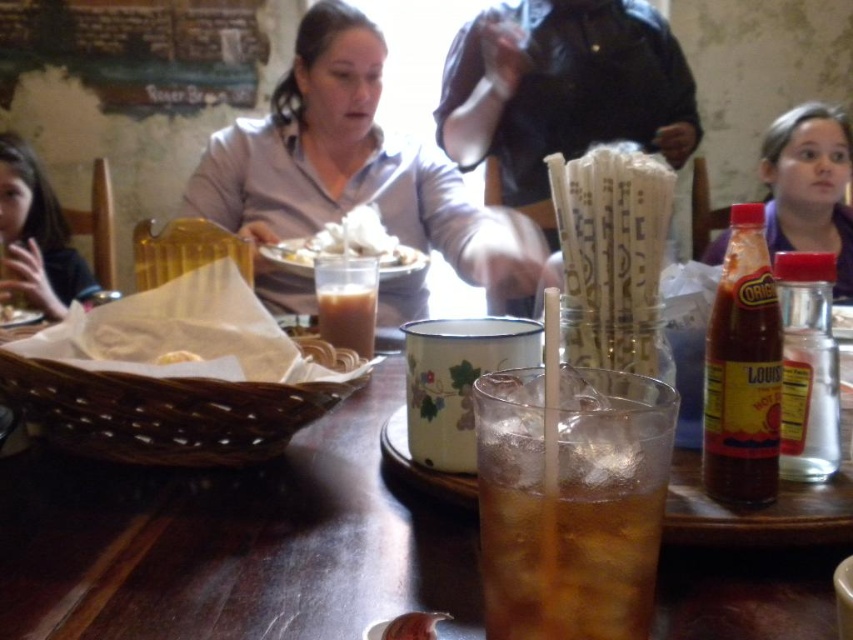
Question: Which object appears farthest from the camera in this image?

Choices:
 (A) brown matte bread at center
 (B) brown translucent glass at center
 (C) white crumbly bread at center

Answer: (C)

Question: Observing the image, what is the correct spatial positioning of white fluffy bread at center in reference to brown matte bread at center?

Choices:
 (A) right
 (B) left

Answer: (B)

Question: Is matte purple shirt at upper right thinner than white crumbly bread at center?

Choices:
 (A) yes
 (B) no

Answer: (B)

Question: Which of the following is the closest to the observer?

Choices:
 (A) translucent glass at center
 (B) brown matte bread at center
 (C) dark brown hair at left

Answer: (B)

Question: Does dark brown hair at left have a lesser width compared to white fluffy bread at center?

Choices:
 (A) yes
 (B) no

Answer: (B)

Question: Estimate the real-world distances between objects in this image. Which object is closer to the dark brown hair at left?

Choices:
 (A) white fluffy bread at center
 (B) matte gray shirt at upper center
 (C) brown liquid at center
 (D) white crumbly bread at center

Answer: (B)